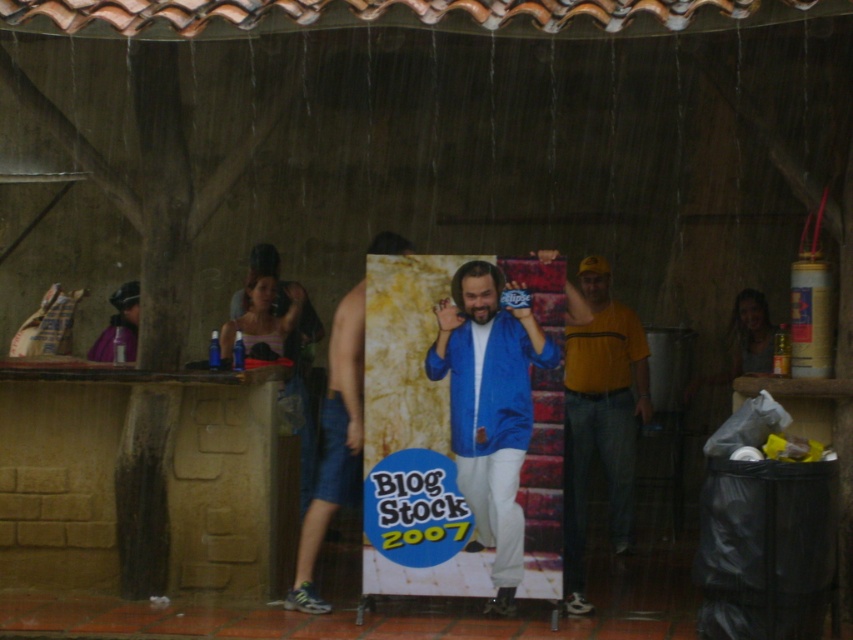
Question: Does yellow cotton t-shirt at right have a smaller size compared to denim shorts at center?

Choices:
 (A) no
 (B) yes

Answer: (A)

Question: From the image, what is the correct spatial relationship of blue shiny jacket at center in relation to denim shorts at center?

Choices:
 (A) below
 (B) above

Answer: (B)

Question: Does blue shiny jacket at center appear over denim shorts at center?

Choices:
 (A) yes
 (B) no

Answer: (A)

Question: Which point is closer to the camera taking this photo?

Choices:
 (A) (473, 348)
 (B) (300, 596)

Answer: (A)

Question: Which object is farther from the camera taking this photo?

Choices:
 (A) blue shiny jacket at center
 (B) yellow cotton t-shirt at right

Answer: (A)

Question: Which object is the farthest from the blue shiny jacket at center?

Choices:
 (A) yellow cotton t-shirt at right
 (B) denim shorts at center

Answer: (A)